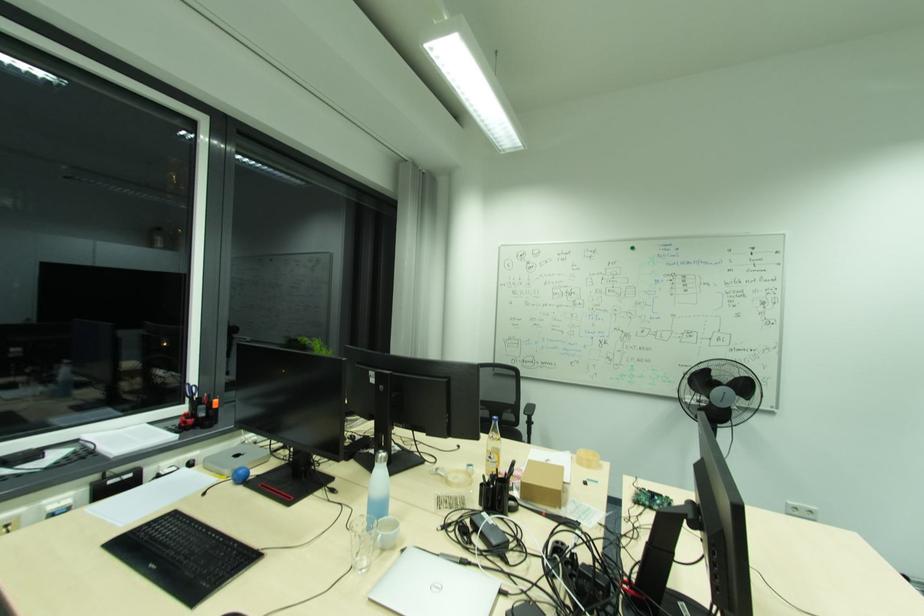
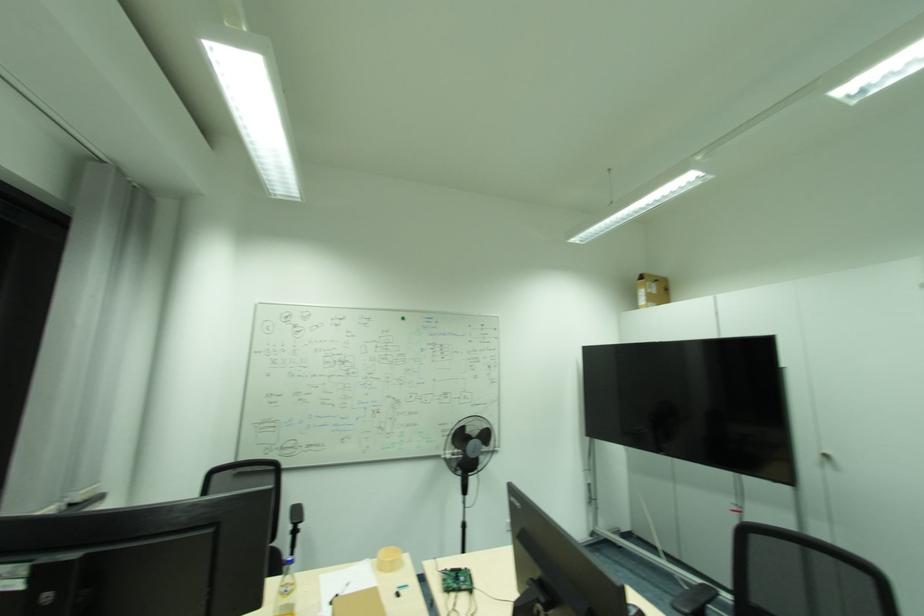
The point at (x=586, y=453) is marked in the first image. Where is the corresponding point in the second image?

(386, 553)